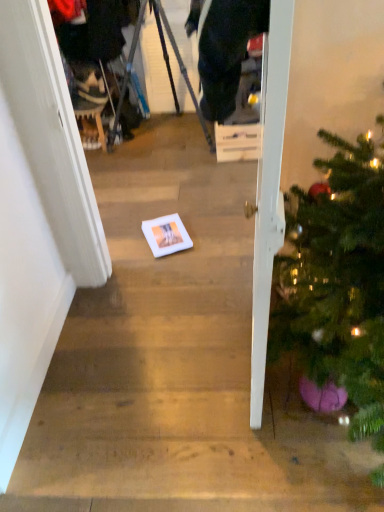
Locate an element on the screen. white glossy door at right is located at coordinates (269, 189).

The image size is (384, 512). Describe the element at coordinates (238, 142) in the screenshot. I see `white cardboard box at center` at that location.

Where is `metallic tripod at center`? The image size is (384, 512). metallic tripod at center is located at coordinates (166, 66).

Considering the positions of objects white cardboard box at center and white glossy door at right in the image provided, who is more to the right, white cardboard box at center or white glossy door at right?

Positioned to the right is white cardboard box at center.

Would you consider white cardboard box at center to be distant from white glossy door at right?

That's right, there is a large distance between white cardboard box at center and white glossy door at right.

Looking at this image, from a real-world perspective, is white cardboard box at center above or below white glossy door at right?

Clearly, from a real-world perspective, white cardboard box at center is below white glossy door at right.

Is white cardboard box at center shorter than white glossy door at right?

Yes.

From the image's perspective, which is below, white glossy door at right or metallic tripod at center?

white glossy door at right.

Is white glossy door at right far away from metallic tripod at center?

That's right, there is a large distance between white glossy door at right and metallic tripod at center.

Looking at this image, is white glossy door at right positioned beyond the bounds of metallic tripod at center?

Yes, white glossy door at right is outside of metallic tripod at center.

Is metallic tripod at center inside or outside of white glossy door at right?

metallic tripod at center is not enclosed by white glossy door at right.

From the image's perspective, relative to white glossy door at right, is metallic tripod at center above or below?

From the image's perspective, metallic tripod at center appears above white glossy door at right.

Is metallic tripod at center positioned with its back to white glossy door at right?

No, metallic tripod at center is not facing away from white glossy door at right.

Consider the image. In terms of height, does metallic tripod at center look taller or shorter compared to white glossy door at right?

Considering their sizes, metallic tripod at center has less height than white glossy door at right.

Is metallic tripod at center in front of or behind white cardboard box at center in the image?

In the image, metallic tripod at center appears in front of white cardboard box at center.

Between point (200, 114) and point (260, 150), which one is positioned in front?

The point (260, 150) is in front.

How many degrees apart are the facing directions of metallic tripod at center and white cardboard box at center?

The angle between the facing direction of metallic tripod at center and the facing direction of white cardboard box at center is 85.5 degrees.

Considering the sizes of metallic tripod at center and white cardboard box at center in the image, is metallic tripod at center bigger or smaller than white cardboard box at center?

metallic tripod at center is bigger than white cardboard box at center.

Is white cardboard box at center aimed at metallic tripod at center?

No, white cardboard box at center is not facing towards metallic tripod at center.

Is white cardboard box at center to the left or to the right of metallic tripod at center in the image?

white cardboard box at center is to the right of metallic tripod at center.

Based on their sizes in the image, would you say white cardboard box at center is bigger or smaller than metallic tripod at center?

In the image, white cardboard box at center appears to be smaller than metallic tripod at center.

From a real-world perspective, is white cardboard box at center below metallic tripod at center?

Indeed, from a real-world perspective, white cardboard box at center is positioned beneath metallic tripod at center.

From a real-world perspective, is white glossy door at right below white cardboard box at center?

No.

Is white glossy door at right to the right of white cardboard box at center from the viewer's perspective?

No.

Is white glossy door at right behind white cardboard box at center?

No, it is not.

The image size is (384, 512). In order to click on door lying in front of the white cardboard box at center in this screenshot , I will do `click(269, 189)`.

Locate an element on the screen. The width and height of the screenshot is (384, 512). door that appears below the metallic tripod at center (from the image's perspective) is located at coordinates (269, 189).

Estimate the real-world distances between objects in this image. Which object is closer to white glossy door at right, white cardboard box at center or metallic tripod at center?

The object closer to white glossy door at right is white cardboard box at center.

From the image, which object appears to be farther from white cardboard box at center, metallic tripod at center or white glossy door at right?

Based on the image, white glossy door at right appears to be further to white cardboard box at center.

Estimate the real-world distances between objects in this image. Which object is closer to metallic tripod at center, white glossy door at right or white cardboard box at center?

white cardboard box at center is closer to metallic tripod at center.

Considering their positions, is white cardboard box at center positioned further to metallic tripod at center than white glossy door at right?

white glossy door at right is further to metallic tripod at center.

Estimate the real-world distances between objects in this image. Which object is further from white cardboard box at center, white glossy door at right or metallic tripod at center?

The object further to white cardboard box at center is white glossy door at right.

Which object lies further to the anchor point white glossy door at right, metallic tripod at center or white cardboard box at center?

metallic tripod at center is further to white glossy door at right.

The width and height of the screenshot is (384, 512). I want to click on tripod between white glossy door at right and white cardboard box at center along the z-axis, so click(x=166, y=66).